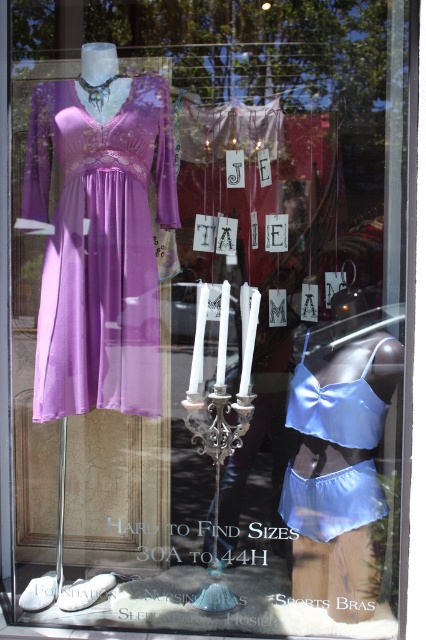
Question: Does matte purple dress at left have a smaller size compared to satin blue lingerie at center?

Choices:
 (A) no
 (B) yes

Answer: (A)

Question: Can you confirm if matte purple dress at left is positioned below satin blue lingerie at center?

Choices:
 (A) no
 (B) yes

Answer: (A)

Question: Which point is farther to the camera?

Choices:
 (A) (310, 376)
 (B) (163, 113)

Answer: (A)

Question: Which of the following is the farthest from the observer?

Choices:
 (A) satin blue lingerie at center
 (B) matte purple dress at left

Answer: (A)

Question: Can you confirm if matte purple dress at left is positioned to the right of satin blue lingerie at center?

Choices:
 (A) no
 (B) yes

Answer: (A)